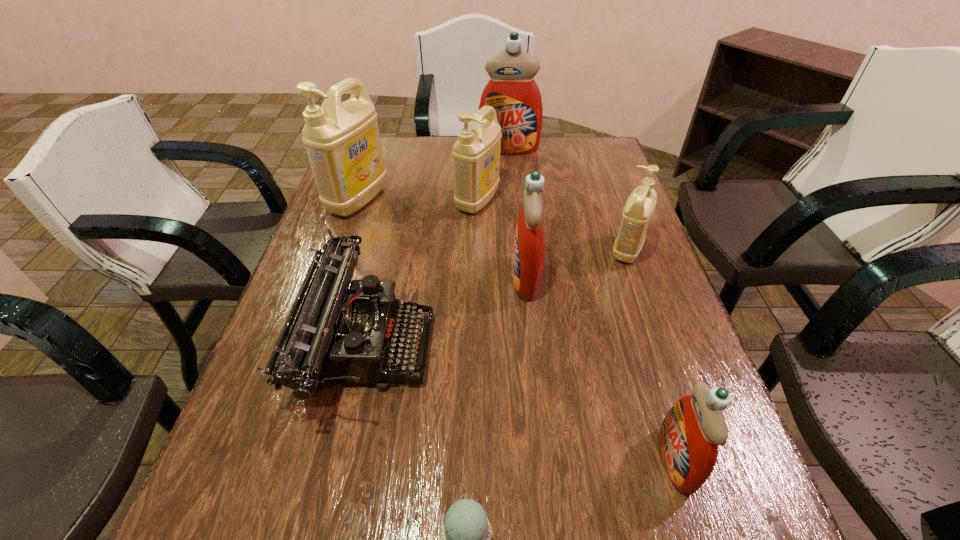
Identify the location of typewriter. (334, 333).

Image resolution: width=960 pixels, height=540 pixels. Find the location of `free spot located 0.320m on the front of the leftmost beige detergent`. free spot located 0.320m on the front of the leftmost beige detergent is located at coordinates (322, 308).

Where is `vacant region located 0.100m on the front surface of the farthest red detergent`? This screenshot has width=960, height=540. vacant region located 0.100m on the front surface of the farthest red detergent is located at coordinates (511, 172).

Identify the location of vacant position located 0.400m on the front surface of the second smallest red detergent. (349, 278).

The image size is (960, 540). I want to click on free space located 0.360m on the front surface of the second smallest red detergent, so click(x=365, y=278).

Image resolution: width=960 pixels, height=540 pixels. In order to click on vacant space situated 0.380m on the front surface of the second smallest red detergent in this screenshot , I will do `click(357, 278)`.

Identify the location of vacant space located on the left of the second beige detergent from left to right. This screenshot has height=540, width=960. (378, 201).

At what (x,y) coordinates should I click in order to perform the action: click on vacant area situated on the back of the smallest beige detergent. Please return your answer as a coordinate pair (x, y). Looking at the image, I should click on (603, 182).

The image size is (960, 540). What are the coordinates of `vacant area situated 0.230m on the front surface of the nearest detergent` in the screenshot? It's located at (529, 460).

Where is `vacant space located 0.050m on the front surface of the nearest detergent`? vacant space located 0.050m on the front surface of the nearest detergent is located at coordinates (631, 460).